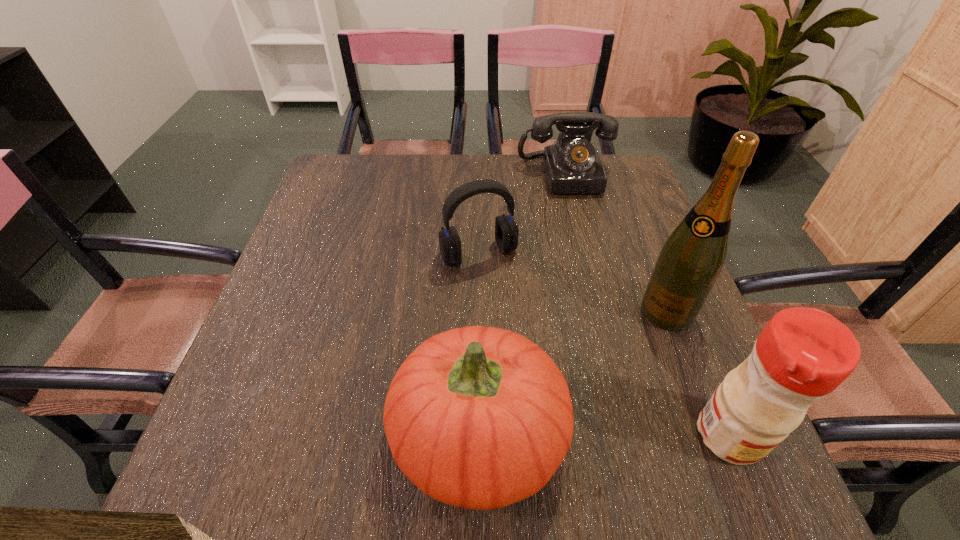
Locate an element on the screen. free space located on the dial of the telephone is located at coordinates tap(594, 282).

Locate an element on the screen. blank space located 0.180m on the dial of the telephone is located at coordinates pos(583,239).

The height and width of the screenshot is (540, 960). I want to click on vacant area situated 0.380m on the headband of the fourth nearest object, so click(564, 415).

Find the location of `free space located on the headband of the fourth nearest object`. free space located on the headband of the fourth nearest object is located at coordinates (555, 396).

Where is `vacant space situated 0.340m on the headband of the fourth nearest object`? vacant space situated 0.340m on the headband of the fourth nearest object is located at coordinates (555, 396).

This screenshot has height=540, width=960. I want to click on vacant region located on the front-facing side of the tallest object, so click(x=641, y=349).

The height and width of the screenshot is (540, 960). What are the coordinates of `vacant space located 0.100m on the front-facing side of the tallest object` in the screenshot? It's located at (635, 359).

Locate an element on the screen. The width and height of the screenshot is (960, 540). vacant space located 0.110m on the front-facing side of the tallest object is located at coordinates (632, 362).

Locate an element on the screen. This screenshot has height=540, width=960. object present at the far edge is located at coordinates (572, 165).

This screenshot has width=960, height=540. I want to click on pumpkin present at the near edge, so click(478, 417).